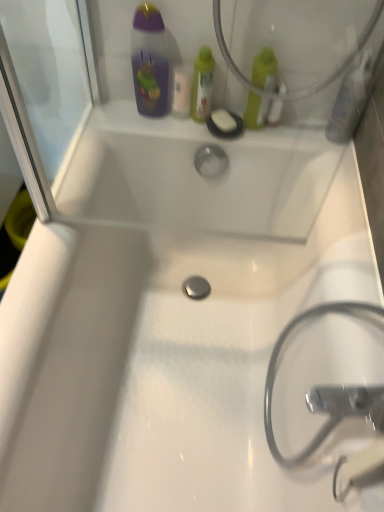
The width and height of the screenshot is (384, 512). I want to click on vacant area situated to the left side of green plastic bottle at upper center, which ranks as the second mouthwash in left-to-right order, so click(143, 121).